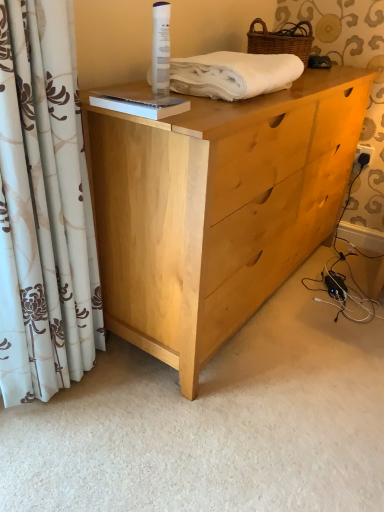
Question: Is white floral curtain at left smaller than woven brown basket at upper right?

Choices:
 (A) yes
 (B) no

Answer: (B)

Question: Can you confirm if white floral curtain at left is positioned to the right of woven brown basket at upper right?

Choices:
 (A) yes
 (B) no

Answer: (B)

Question: From a real-world perspective, is white floral curtain at left under woven brown basket at upper right?

Choices:
 (A) yes
 (B) no

Answer: (A)

Question: From the image's perspective, is white floral curtain at left above woven brown basket at upper right?

Choices:
 (A) yes
 (B) no

Answer: (B)

Question: Does white floral curtain at left appear on the left side of woven brown basket at upper right?

Choices:
 (A) no
 (B) yes

Answer: (B)

Question: Does point (196, 89) appear closer or farther from the camera than point (261, 138)?

Choices:
 (A) farther
 (B) closer

Answer: (B)

Question: Is white cotton towel at upper center wider or thinner than light wood dresser at center?

Choices:
 (A) thin
 (B) wide

Answer: (A)

Question: Is white cotton towel at upper center situated inside light wood dresser at center or outside?

Choices:
 (A) outside
 (B) inside

Answer: (A)

Question: In terms of height, does white cotton towel at upper center look taller or shorter compared to light wood dresser at center?

Choices:
 (A) short
 (B) tall

Answer: (A)

Question: Considering the positions of light wood dresser at center and white cotton towel at upper center in the image, is light wood dresser at center wider or thinner than white cotton towel at upper center?

Choices:
 (A) thin
 (B) wide

Answer: (B)

Question: Considering the positions of point (345, 156) and point (281, 76), is point (345, 156) closer or farther from the camera than point (281, 76)?

Choices:
 (A) farther
 (B) closer

Answer: (A)

Question: From a real-world perspective, is light wood dresser at center physically located above or below white cotton towel at upper center?

Choices:
 (A) below
 (B) above

Answer: (A)

Question: Visually, is light wood dresser at center positioned to the left or to the right of white cotton towel at upper center?

Choices:
 (A) left
 (B) right

Answer: (B)

Question: From a real-world perspective, relative to white cotton towel at upper center, is white floral curtain at left vertically above or below?

Choices:
 (A) above
 (B) below

Answer: (B)

Question: Considering the positions of point (x=11, y=373) and point (x=178, y=76), is point (x=11, y=373) closer or farther from the camera than point (x=178, y=76)?

Choices:
 (A) farther
 (B) closer

Answer: (A)